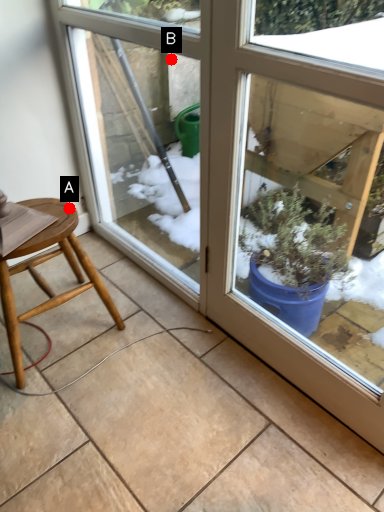
Question: Two points are circled on the image, labeled by A and B beside each circle. Which of the following is the farthest from the observer?

Choices:
 (A) A is further
 (B) B is further

Answer: (B)